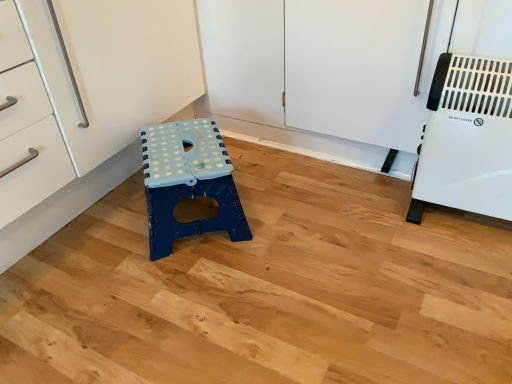
The height and width of the screenshot is (384, 512). In order to click on vacant area that lies to the right of blue plastic stool at center in this screenshot , I will do `click(292, 215)`.